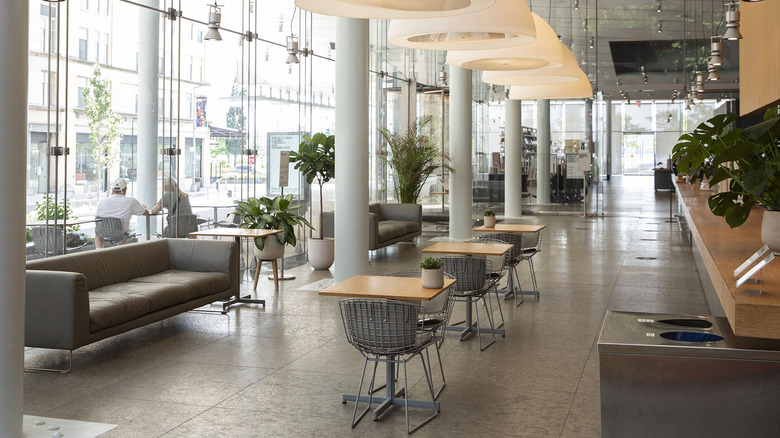
Locate an element on the screen. The width and height of the screenshot is (780, 438). chairs is located at coordinates click(377, 331), click(469, 284), click(518, 244), click(442, 316), click(512, 261), click(526, 222).